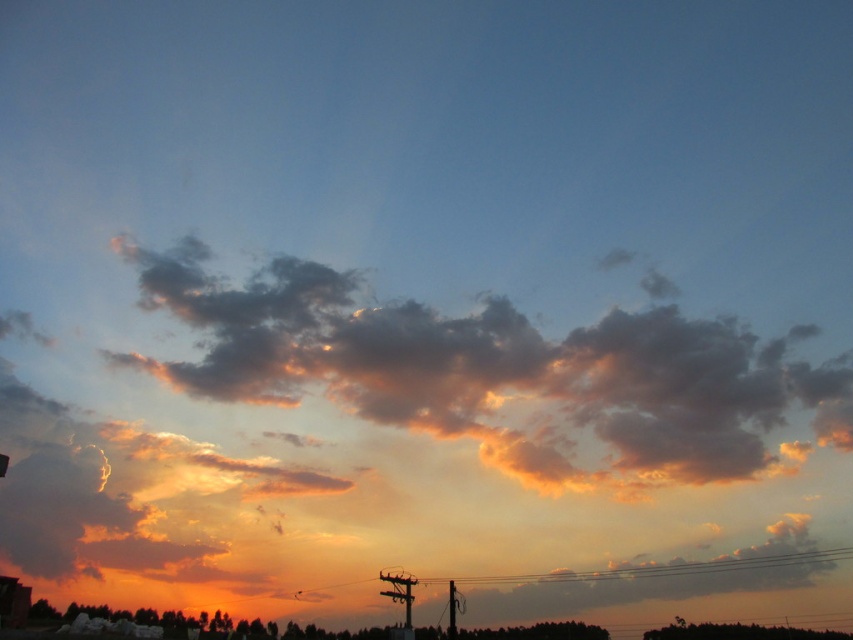
Between orange-hued cotton clouds at upper center and metallic wire at center, which one has more height?

orange-hued cotton clouds at upper center is taller.

Who is positioned more to the right, orange-hued cotton clouds at upper center or metallic wire at center?

metallic wire at center

Which is behind, point (341, 358) or point (717, 570)?

The point (717, 570) is more distant.

Locate an element on the screen. orange-hued cotton clouds at upper center is located at coordinates (502, 374).